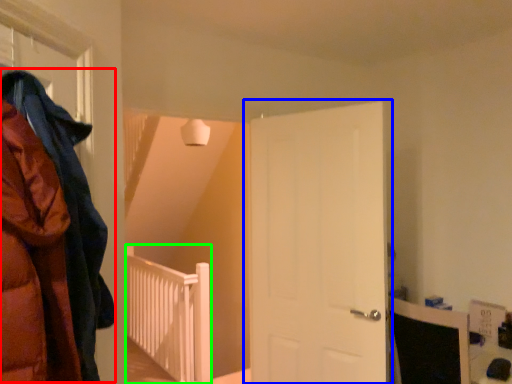
Question: Which is farther away from cloak (highlighted by a red box)? door (highlighted by a blue box) or rail (highlighted by a green box)?

Choices:
 (A) door
 (B) rail

Answer: (B)